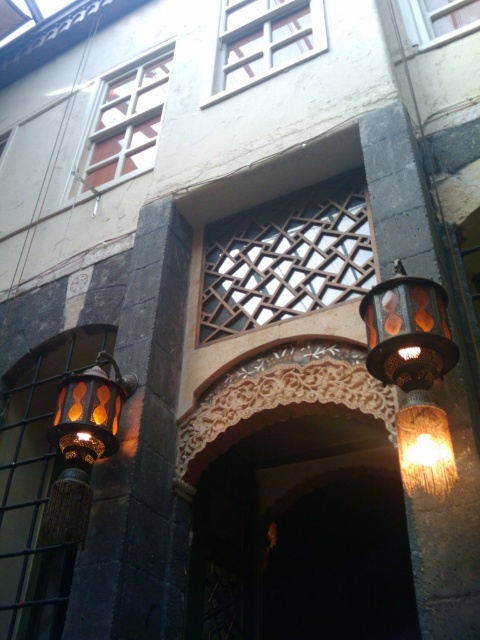
Is point (124, 161) positioned after point (299, 24)?

Yes, it is behind point (299, 24).

Which is above, white lattice window at upper left or clear glass window at upper center?

clear glass window at upper center is higher up.

Image resolution: width=480 pixels, height=640 pixels. I want to click on white lattice window at upper left, so click(123, 124).

Is clear glass window at upper center wider than matte bronze lantern at left?

Yes.

Who is shorter, clear glass window at upper center or matte bronze lantern at left?

Standing shorter between the two is matte bronze lantern at left.

Is point (269, 35) positioned in front of point (117, 412)?

No, it is behind (117, 412).

The image size is (480, 640). In order to click on clear glass window at upper center in this screenshot , I will do `click(263, 40)`.

In the scene shown: Is the position of wooden lattice at center more distant than that of clear glass window at upper center?

No.

Does point (223, 282) come farther from viewer compared to point (252, 38)?

No, (223, 282) is closer to viewer.

Identify the location of wooden lattice at center. (286, 259).